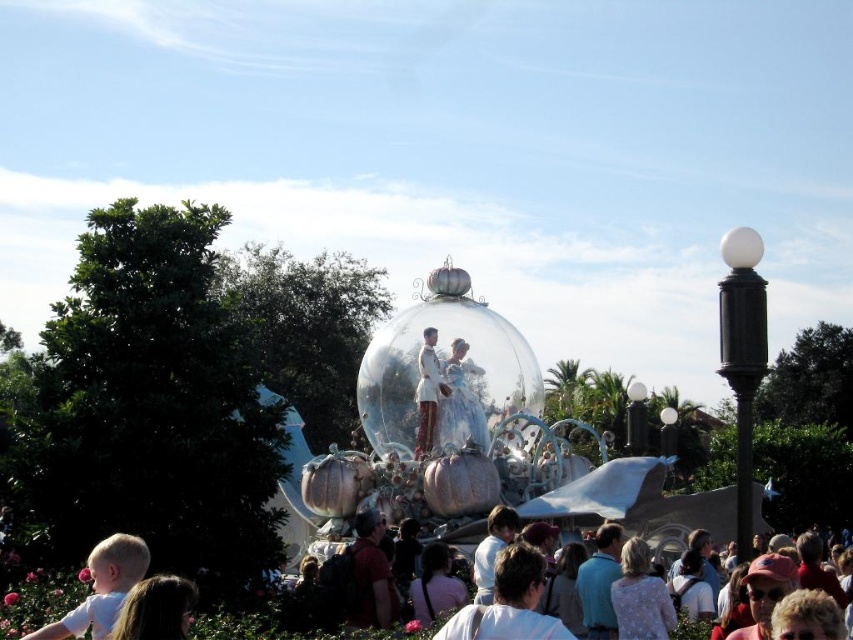
Question: Which point is closer to the camera?

Choices:
 (A) (231, 380)
 (B) (131, 636)
 (C) (526, 563)
 (D) (383, 618)

Answer: (B)

Question: Does transparent glass float at center appear on the left side of blonde hair at lower left?

Choices:
 (A) no
 (B) yes

Answer: (A)

Question: Does transparent glass float at center have a lesser width compared to matte red backpack at center?

Choices:
 (A) no
 (B) yes

Answer: (A)

Question: Which object is positioned closest to the matte red backpack at center?

Choices:
 (A) white satin dress at center
 (B) blonde hair at lower left
 (C) white cotton shirt at center
 (D) transparent glass float at center

Answer: (C)

Question: Which object is the farthest from the white matte shirt at lower left?

Choices:
 (A) blonde hair at lower left
 (B) white satin dress at center
 (C) transparent glass float at center

Answer: (B)

Question: Is white matte shirt at lower left to the left of white satin dress at center from the viewer's perspective?

Choices:
 (A) yes
 (B) no

Answer: (A)